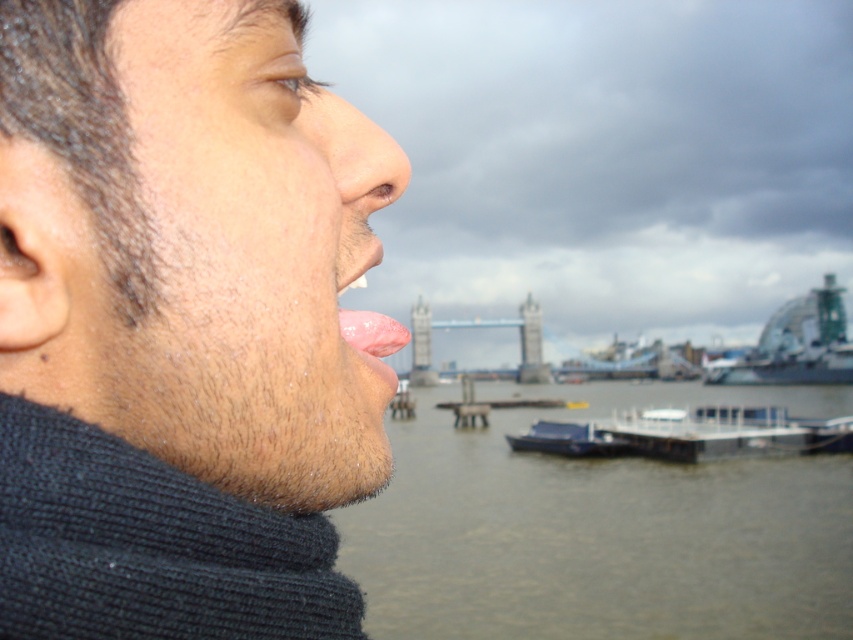
Question: Can you confirm if smooth skin face at left is bigger than pink flesh at center?

Choices:
 (A) no
 (B) yes

Answer: (B)

Question: Which point is closer to the camera taking this photo?

Choices:
 (A) (364, 340)
 (B) (683, 557)
 (C) (184, 154)
 (D) (540, 451)

Answer: (C)

Question: Is green glass dome at center wider than stone gray tower bridge at center?

Choices:
 (A) yes
 (B) no

Answer: (B)

Question: Estimate the real-world distances between objects in this image. Which object is closer to the pink flesh at center?

Choices:
 (A) smooth skin face at left
 (B) matte skin nose at center
 (C) smooth blue boat at center

Answer: (B)

Question: Is metallic gray boat at lower center bigger than matte skin nose at center?

Choices:
 (A) no
 (B) yes

Answer: (B)

Question: Which point is farther from the camera taking this photo?

Choices:
 (A) (372, 259)
 (B) (419, 353)
 (C) (233, 35)
 (D) (782, 380)

Answer: (B)